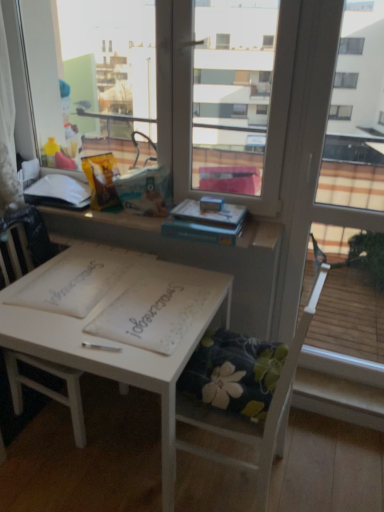
Question: Is white paper notebook at center, which appears as the second notebook when viewed from the left, a part of white matte book at upper left, the first book in the left-to-right sequence?

Choices:
 (A) yes
 (B) no

Answer: (B)

Question: Considering the relative positions of white matte book at upper left, acting as the second book starting from the right, and white paper notebook at center, which is the 1th notebook from right to left, in the image provided, is white matte book at upper left, acting as the second book starting from the right, to the right of white paper notebook at center, which is the 1th notebook from right to left, from the viewer's perspective?

Choices:
 (A) no
 (B) yes

Answer: (A)

Question: From a real-world perspective, is white matte book at upper left, the first book in the left-to-right sequence, under white paper notebook at center, which appears as the second notebook when viewed from the left?

Choices:
 (A) yes
 (B) no

Answer: (B)

Question: Does white matte book at upper left, acting as the 2th book starting from the front, have a smaller size compared to white paper notebook at center, which appears as the second notebook when viewed from the left?

Choices:
 (A) no
 (B) yes

Answer: (A)

Question: Is the position of white matte book at upper left, the first book in the left-to-right sequence, more distant than that of white paper notebook at center, which appears as the second notebook when viewed from the left?

Choices:
 (A) yes
 (B) no

Answer: (A)

Question: Considering the positions of point (243, 207) and point (74, 182), is point (243, 207) closer or farther from the camera than point (74, 182)?

Choices:
 (A) farther
 (B) closer

Answer: (B)

Question: Is hardcover book at upper center, arranged as the second book when viewed from the left, to the left or to the right of white matte book at upper left, marked as the 1th book in a back-to-front arrangement, in the image?

Choices:
 (A) right
 (B) left

Answer: (A)

Question: From the image's perspective, is hardcover book at upper center, the 1th book in the right-to-left sequence, located above or below white matte book at upper left, acting as the second book starting from the right?

Choices:
 (A) above
 (B) below

Answer: (B)

Question: Is hardcover book at upper center, which appears as the second book when viewed from the back, bigger or smaller than white matte book at upper left, acting as the second book starting from the right?

Choices:
 (A) small
 (B) big

Answer: (B)

Question: Based on their positions, is white wood chair at center, which is the 1th chair in left-to-right order, located to the left or right of white matte book at upper left, the first book in the left-to-right sequence?

Choices:
 (A) right
 (B) left

Answer: (A)

Question: Considering the positions of white wood chair at center, which is the 1th chair in left-to-right order, and white matte book at upper left, the first book in the left-to-right sequence, in the image, is white wood chair at center, which is the 1th chair in left-to-right order, bigger or smaller than white matte book at upper left, the first book in the left-to-right sequence,?

Choices:
 (A) small
 (B) big

Answer: (B)

Question: From the image's perspective, is white wood chair at center, positioned as the second chair in right-to-left order, positioned above or below white matte book at upper left, marked as the 1th book in a back-to-front arrangement?

Choices:
 (A) below
 (B) above

Answer: (A)

Question: Do you think white wood chair at center, positioned as the second chair in right-to-left order, is within white matte book at upper left, acting as the second book starting from the right, or outside of it?

Choices:
 (A) inside
 (B) outside

Answer: (B)

Question: From a real-world perspective, is white matte book at upper left, acting as the second book starting from the right, positioned above or below floral fabric cushion at lower center, the 2th chair when ordered from left to right?

Choices:
 (A) above
 (B) below

Answer: (A)

Question: Considering the positions of white matte book at upper left, the first book in the left-to-right sequence, and floral fabric cushion at lower center, the 2th chair when ordered from left to right, in the image, is white matte book at upper left, the first book in the left-to-right sequence, taller or shorter than floral fabric cushion at lower center, the 2th chair when ordered from left to right,?

Choices:
 (A) tall
 (B) short

Answer: (B)